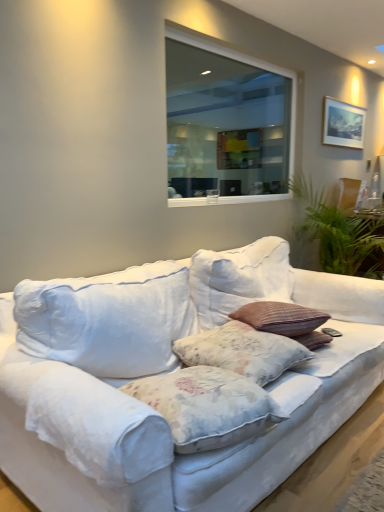
Question: Does white fabric couch at center have a greater height compared to transparent glass window at upper center?

Choices:
 (A) no
 (B) yes

Answer: (A)

Question: From the image's perspective, is white fabric couch at center on top of transparent glass window at upper center?

Choices:
 (A) no
 (B) yes

Answer: (A)

Question: Is white fabric couch at center shorter than transparent glass window at upper center?

Choices:
 (A) yes
 (B) no

Answer: (A)

Question: Is white fabric couch at center at the right side of transparent glass window at upper center?

Choices:
 (A) no
 (B) yes

Answer: (A)

Question: Is white fabric couch at center closer to camera compared to transparent glass window at upper center?

Choices:
 (A) yes
 (B) no

Answer: (A)

Question: Is white fabric couch at center aimed at transparent glass window at upper center?

Choices:
 (A) no
 (B) yes

Answer: (A)

Question: From the image's perspective, would you say transparent glass window at upper center is shown under floral fabric pillow at center, the second pillow from the front?

Choices:
 (A) no
 (B) yes

Answer: (A)

Question: Can you confirm if transparent glass window at upper center is positioned to the left of floral fabric pillow at center, the second pillow from the front?

Choices:
 (A) no
 (B) yes

Answer: (A)

Question: Is transparent glass window at upper center far away from floral fabric pillow at center, the second pillow from the front?

Choices:
 (A) yes
 (B) no

Answer: (A)

Question: Are transparent glass window at upper center and floral fabric pillow at center, the second pillow from the front, making contact?

Choices:
 (A) no
 (B) yes

Answer: (A)

Question: Is transparent glass window at upper center completely or partially outside of floral fabric pillow at center, which appears as the 1th pillow when viewed from the back?

Choices:
 (A) yes
 (B) no

Answer: (A)

Question: From a real-world perspective, does transparent glass window at upper center sit lower than floral fabric pillow at center, the second pillow from the front?

Choices:
 (A) yes
 (B) no

Answer: (B)

Question: Is white fabric couch at center located outside green leafy plant at right?

Choices:
 (A) no
 (B) yes

Answer: (B)